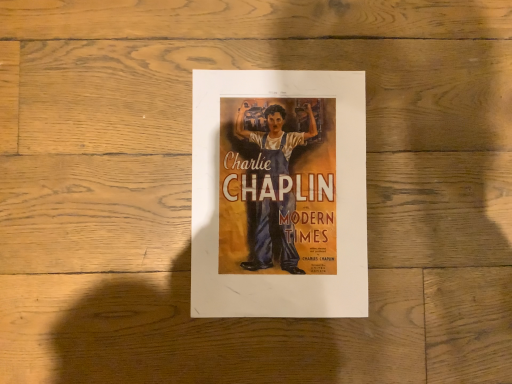
Where is `matte paper poster at center`? This screenshot has width=512, height=384. matte paper poster at center is located at coordinates (279, 194).

The image size is (512, 384). What do you see at coordinates (279, 194) in the screenshot?
I see `matte paper poster at center` at bounding box center [279, 194].

At what (x,y) coordinates should I click in order to perform the action: click on matte paper poster at center. Please return your answer as a coordinate pair (x, y). This screenshot has width=512, height=384. Looking at the image, I should click on (279, 194).